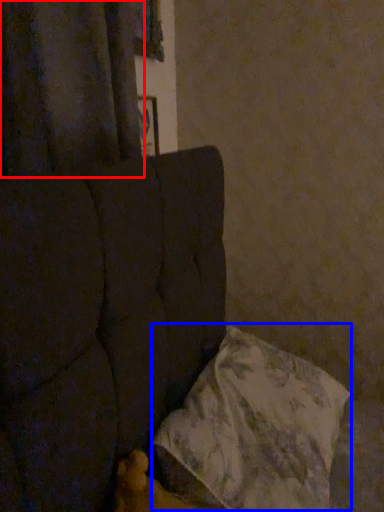
Question: Which of the following is the closest to the observer, curtain (highlighted by a red box) or pillow (highlighted by a blue box)?

Choices:
 (A) curtain
 (B) pillow

Answer: (B)